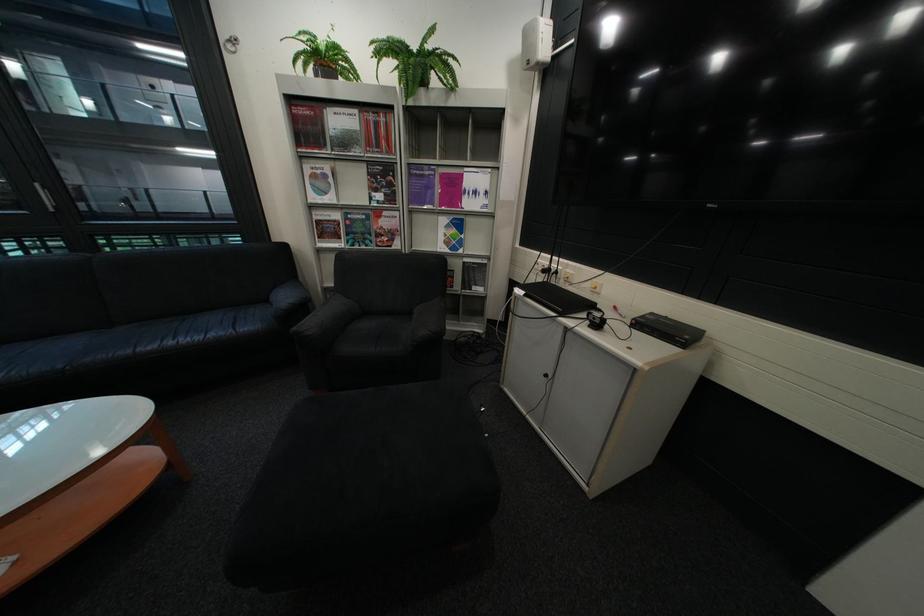
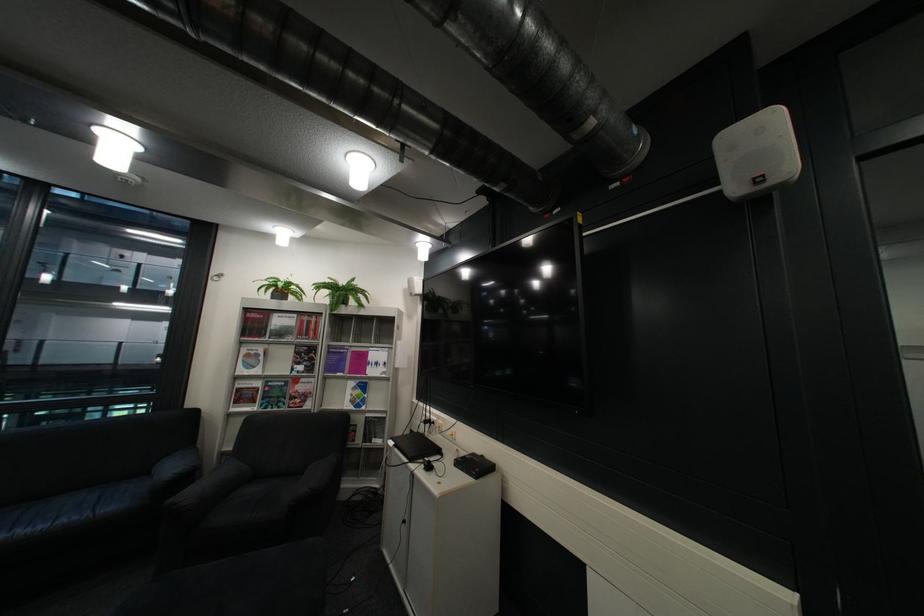
Locate, in the second image, the point that corresponds to pixel 385 175 in the first image.

(311, 353)